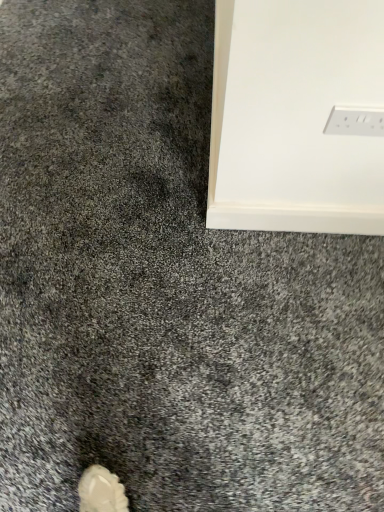
In order to click on white plastic power plugs and sockets at upper right in this screenshot , I will do `click(355, 121)`.

What do you see at coordinates (355, 121) in the screenshot? I see `white plastic power plugs and sockets at upper right` at bounding box center [355, 121].

In the scene shown: In order to face white plastic power plugs and sockets at upper right, should I rotate leftwards or rightwards?

Turn right approximately 21.806 degrees to face it.

I want to click on white plastic power plugs and sockets at upper right, so click(x=355, y=121).